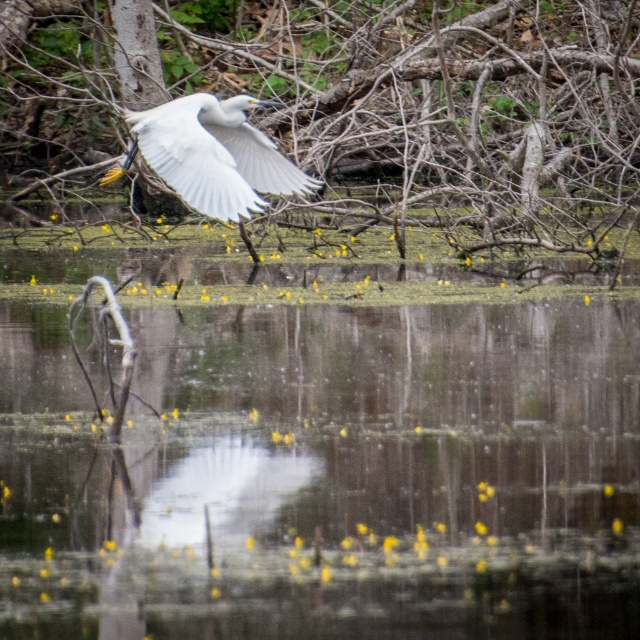
You are an ornithologist observing the scene. You notice the smooth bark tree at upper center and the white feathered bird at center. Which object would you estimate to be bigger in size?

The smooth bark tree at upper center is larger in size than the white feathered bird at center.